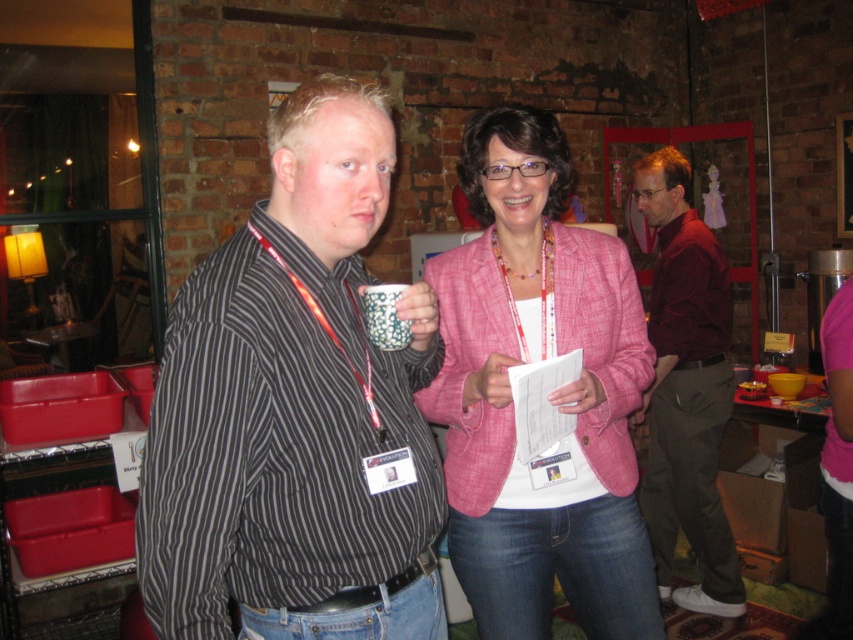
Question: Which object appears farthest from the camera in this image?

Choices:
 (A) pink textured blazer at center
 (B) maroon corduroy shirt at right
 (C) black striped shirt at center
 (D) glossy ceramic mug at upper center

Answer: (B)

Question: Estimate the real-world distances between objects in this image. Which object is closer to the black striped shirt at center?

Choices:
 (A) pink textured blazer at center
 (B) maroon corduroy shirt at right
 (C) glossy ceramic mug at upper center

Answer: (C)

Question: Does pink textured blazer at center have a lesser width compared to maroon corduroy shirt at right?

Choices:
 (A) no
 (B) yes

Answer: (A)

Question: Which object appears farthest from the camera in this image?

Choices:
 (A) glossy ceramic mug at upper center
 (B) black striped shirt at center
 (C) pink textured blazer at center
 (D) maroon corduroy shirt at right

Answer: (D)

Question: Does maroon corduroy shirt at right appear under glossy ceramic mug at upper center?

Choices:
 (A) yes
 (B) no

Answer: (A)

Question: Can you confirm if pink textured blazer at center is wider than glossy ceramic mug at upper center?

Choices:
 (A) yes
 (B) no

Answer: (A)